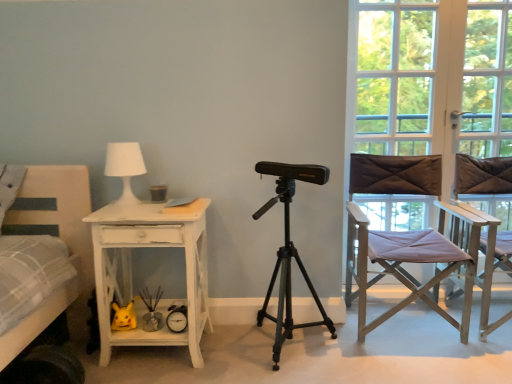
The image size is (512, 384). I want to click on free location to the right of white distressed wood desk at left, so click(x=232, y=355).